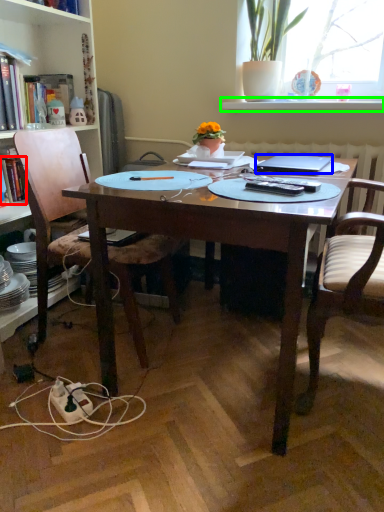
Question: Estimate the real-world distances between objects in this image. Which object is closer to book (highlighted by a red box), laptop (highlighted by a blue box) or window sill (highlighted by a green box)?

Choices:
 (A) laptop
 (B) window sill

Answer: (A)